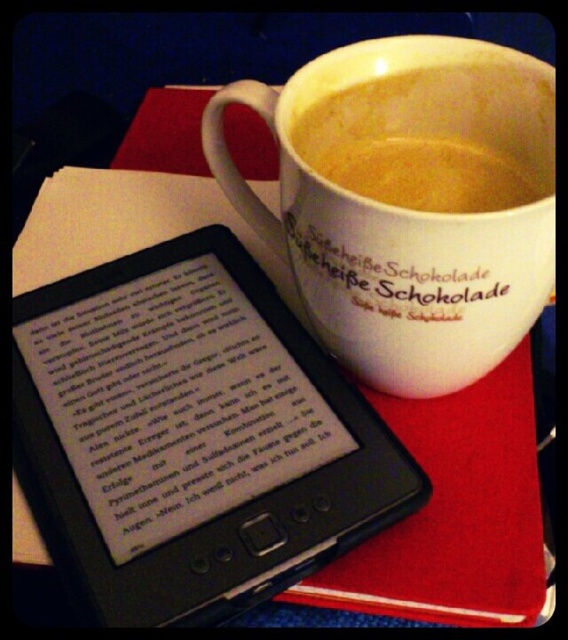
Question: Is black matte tablet computer at upper left thinner than white matte cup of coffee at upper center?

Choices:
 (A) no
 (B) yes

Answer: (A)

Question: Is black matte tablet computer at upper left positioned before white matte cup of coffee at upper center?

Choices:
 (A) no
 (B) yes

Answer: (B)

Question: Is black matte tablet computer at upper left thinner than white matte mug at upper center?

Choices:
 (A) yes
 (B) no

Answer: (B)

Question: Which point is farther to the camera?

Choices:
 (A) white matte mug at upper center
 (B) white matte cup of coffee at upper center

Answer: (B)

Question: Among these objects, which one is nearest to the camera?

Choices:
 (A) black matte tablet computer at upper left
 (B) white matte cup of coffee at upper center
 (C) white matte mug at upper center

Answer: (C)

Question: Which point is closer to the camera taking this photo?

Choices:
 (A) (471, 148)
 (B) (52, 307)
 (C) (437, 113)

Answer: (B)